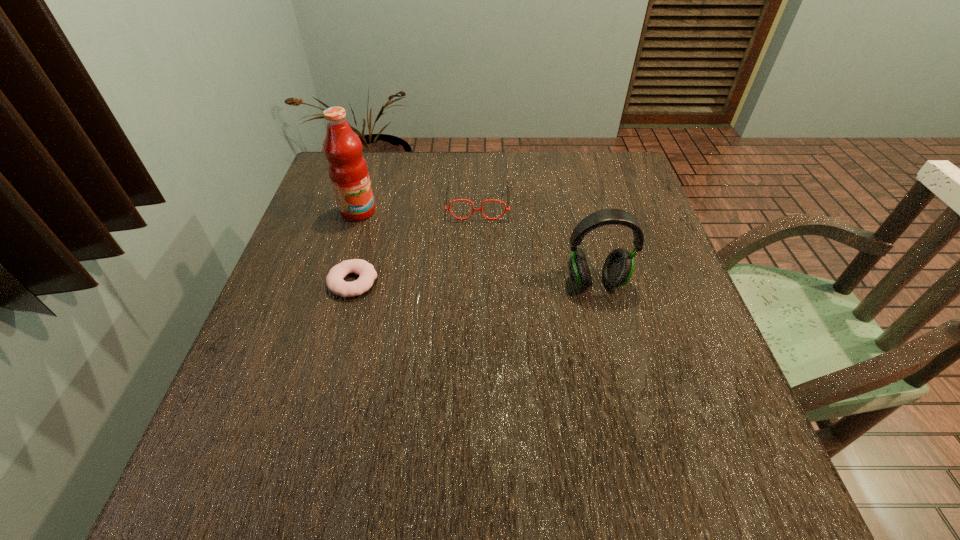
Find the location of a particular element. Image resolution: width=960 pixels, height=540 pixels. vacant space on the desktop that is between the shortest object and the headset and is positioned on the front label of the fruit juice is located at coordinates (503, 281).

The height and width of the screenshot is (540, 960). I want to click on free space on the desktop that is between the shortest object and the second tallest object and is positioned on the front-facing side of the spectacles, so click(x=475, y=281).